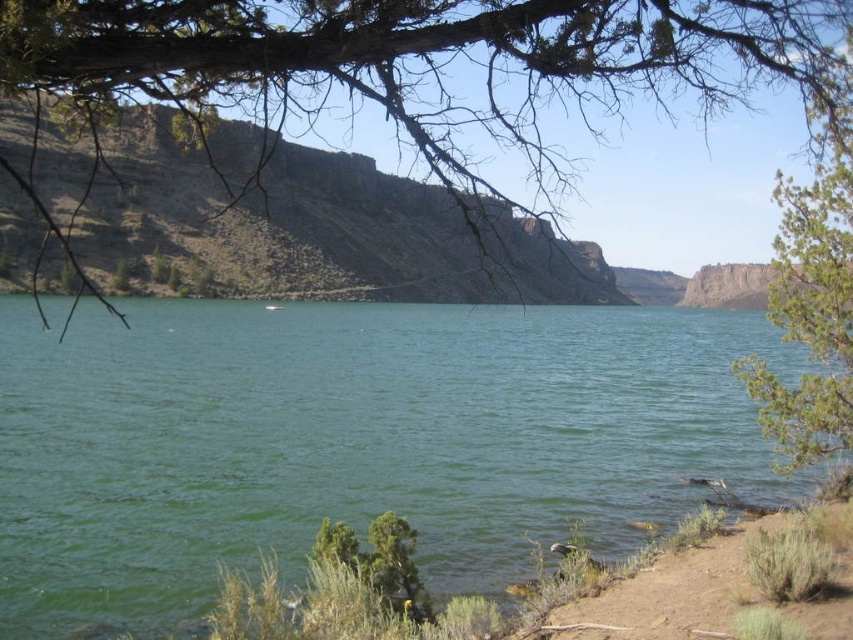
You are standing at the center of the image and want to locate the point marked at coordinates (413, 61). Based on the scene description, where would this point be located in relation to the green leafy tree at upper left?

The point marked at coordinates (413, 61) is located on the green leafy tree at upper left.

You are an environmental scientist assessing the stability of the landscape. Given the presence of the green leafy tree at upper left and the rugged rock cliff at upper right, which object might contribute more to preventing soil erosion in this area?

The green leafy tree at upper left contributes more to preventing soil erosion because its roots can hold the soil in place, even though it is thinner than the rugged rock cliff at upper right.

What is the 2D coordinate of the brown rocky cliff at upper center in the image?

The brown rocky cliff at upper center is located at the 2D coordinate point of (312, 230).